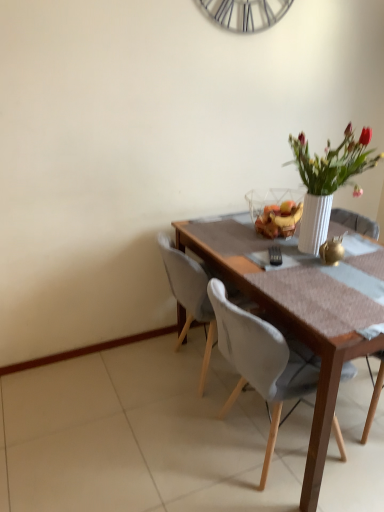
Question: Is wooden chair at right, which is the 1th chair in right-to-left order, not within white fabric chair at center, acting as the 1th chair starting from the left?

Choices:
 (A) no
 (B) yes

Answer: (B)

Question: Is white fabric chair at center, which is counted as the third chair, starting from the right, at the back of wooden chair at right, positioned as the third chair in left-to-right order?

Choices:
 (A) no
 (B) yes

Answer: (A)

Question: Is wooden chair at right, which is the 1th chair in right-to-left order, positioned before white fabric chair at center, which is counted as the third chair, starting from the right?

Choices:
 (A) no
 (B) yes

Answer: (B)

Question: From the image's perspective, is wooden chair at right, positioned as the third chair in left-to-right order, beneath white fabric chair at center, acting as the 1th chair starting from the left?

Choices:
 (A) no
 (B) yes

Answer: (B)

Question: From the image's perspective, would you say wooden chair at right, positioned as the third chair in left-to-right order, is positioned over white fabric chair at center, acting as the 1th chair starting from the left?

Choices:
 (A) no
 (B) yes

Answer: (A)

Question: Considering the positions of white fabric chair at center, acting as the 1th chair starting from the left, and wooden chair at right, which is the 1th chair in right-to-left order, in the image, is white fabric chair at center, acting as the 1th chair starting from the left, wider or thinner than wooden chair at right, which is the 1th chair in right-to-left order,?

Choices:
 (A) thin
 (B) wide

Answer: (A)

Question: Is white fabric chair at center, acting as the 1th chair starting from the left, in front of or behind wooden chair at right, positioned as the third chair in left-to-right order, in the image?

Choices:
 (A) behind
 (B) front

Answer: (A)

Question: In terms of size, does white fabric chair at center, which is counted as the third chair, starting from the right, appear bigger or smaller than wooden chair at right, which is the 1th chair in right-to-left order?

Choices:
 (A) small
 (B) big

Answer: (A)

Question: From a real-world perspective, is white fabric chair at center, acting as the 1th chair starting from the left, above or below wooden chair at right, positioned as the third chair in left-to-right order?

Choices:
 (A) above
 (B) below

Answer: (A)

Question: Considering their positions, is white fabric chair at center, which is counted as the second chair, starting from the right, located in front of or behind wooden chair at right, which is the 1th chair in right-to-left order?

Choices:
 (A) front
 (B) behind

Answer: (A)

Question: Is white fabric chair at center, which ranks as the 2th chair in left-to-right order, bigger or smaller than wooden chair at right, positioned as the third chair in left-to-right order?

Choices:
 (A) small
 (B) big

Answer: (B)

Question: Is white fabric chair at center, which is counted as the second chair, starting from the right, to the left or to the right of wooden chair at right, positioned as the third chair in left-to-right order, in the image?

Choices:
 (A) left
 (B) right

Answer: (A)

Question: Is white fabric chair at center, which ranks as the 2th chair in left-to-right order, inside the boundaries of wooden chair at right, positioned as the third chair in left-to-right order, or outside?

Choices:
 (A) outside
 (B) inside

Answer: (A)

Question: Choose the correct answer: Is wooden chair at right, which is the 1th chair in right-to-left order, inside white fabric chair at center, acting as the 1th chair starting from the left, or outside it?

Choices:
 (A) outside
 (B) inside

Answer: (A)

Question: Is wooden chair at right, which is the 1th chair in right-to-left order, taller or shorter than white fabric chair at center, acting as the 1th chair starting from the left?

Choices:
 (A) tall
 (B) short

Answer: (B)